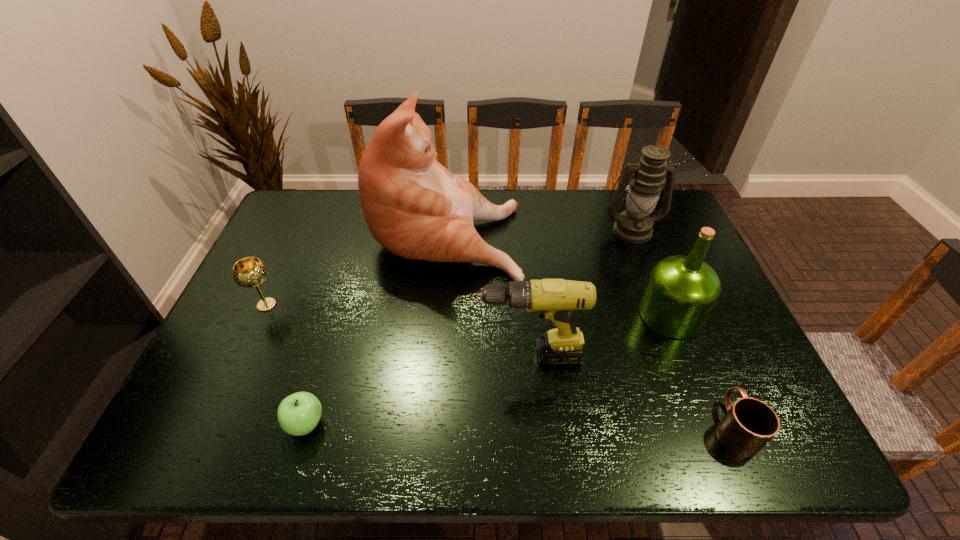
The height and width of the screenshot is (540, 960). I want to click on oil lamp at the far edge, so click(634, 224).

Locate an element on the screen. The image size is (960, 540). apple located at the near edge is located at coordinates (298, 414).

Locate an element on the screen. This screenshot has width=960, height=540. mug at the near edge is located at coordinates (x=749, y=424).

Find the location of a particular element. The width and height of the screenshot is (960, 540). object present at the left edge is located at coordinates (249, 272).

Where is `oil lamp present at the right edge`? oil lamp present at the right edge is located at coordinates (634, 224).

The image size is (960, 540). Identify the location of olive oil situated at the right edge. (681, 292).

Locate an element on the screen. mug at the right edge is located at coordinates (749, 424).

At what (x,y) coordinates should I click in order to perform the action: click on object that is positioned at the far right corner. Please return your answer as a coordinate pair (x, y). The image size is (960, 540). Looking at the image, I should click on (634, 224).

Where is `object that is at the near right corner`? object that is at the near right corner is located at coordinates (749, 424).

The width and height of the screenshot is (960, 540). In the image, there is a desktop. Identify the location of vacant space at the far edge. (594, 192).